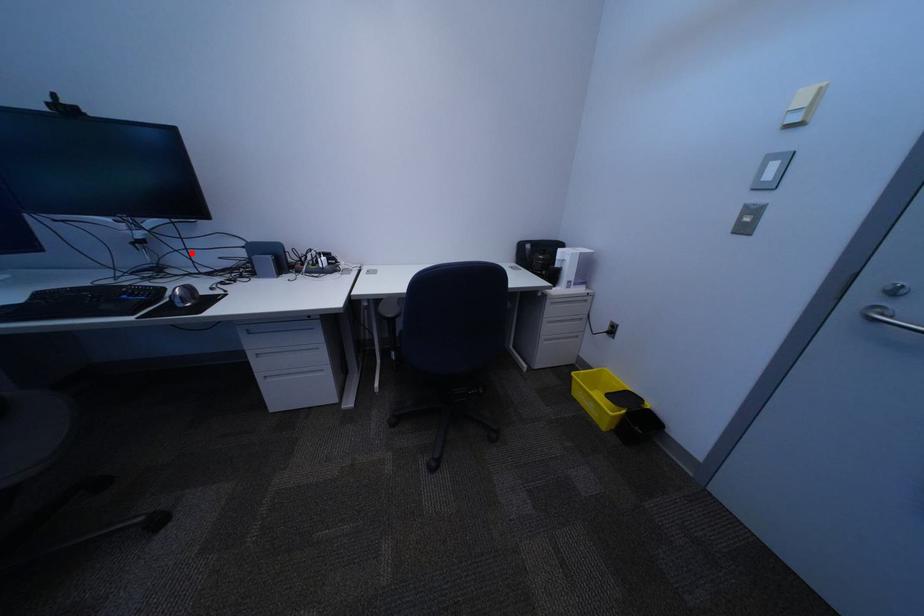
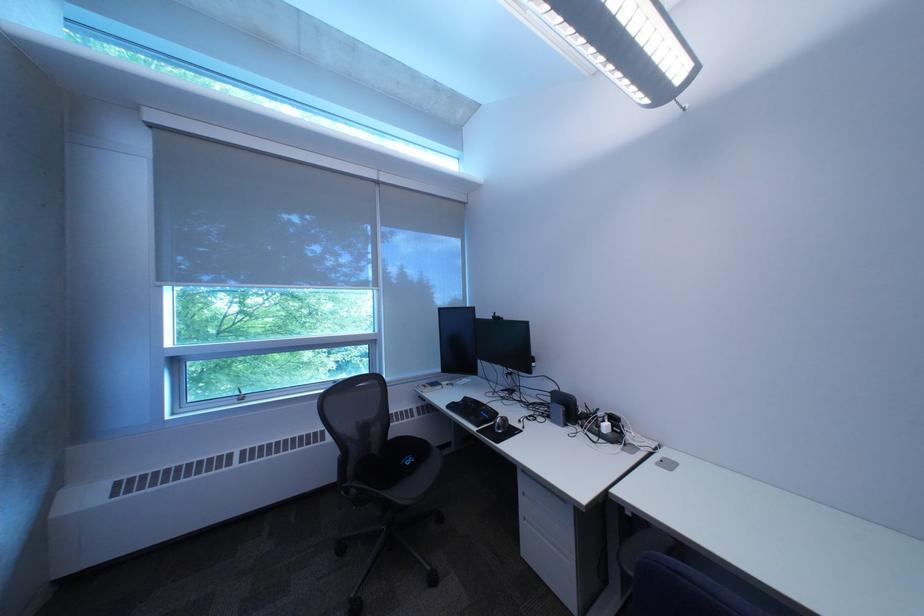
The point at the highlighted location is marked in the first image. Where is the corresponding point in the second image?

(532, 387)